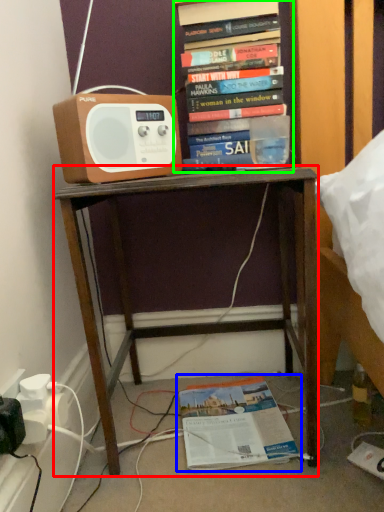
Question: Considering the real-world distances, which object is closest to desk (highlighted by a red box)? book (highlighted by a blue box) or book (highlighted by a green box).

Choices:
 (A) book
 (B) book

Answer: (A)